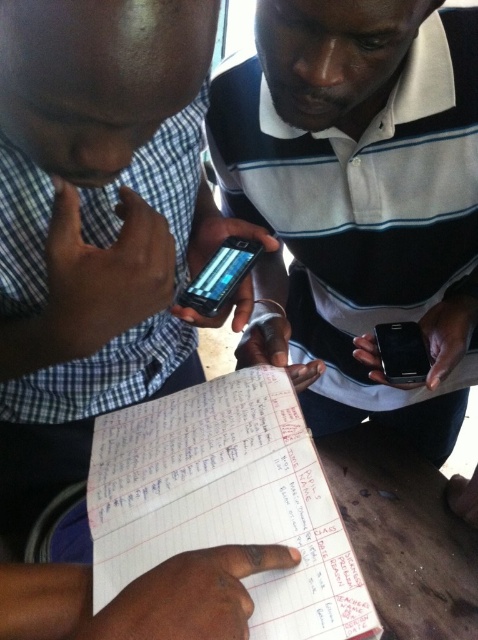
You are a delivery person who needs to place a new tablet between the white paper at center and the black glossy smartphone at center. According to the scene description, where should you position the tablet?

The white paper at center is to the left of the black glossy smartphone at center, so you should place the tablet to the right of the white paper at center and to the left of the black glossy smartphone at center between them.